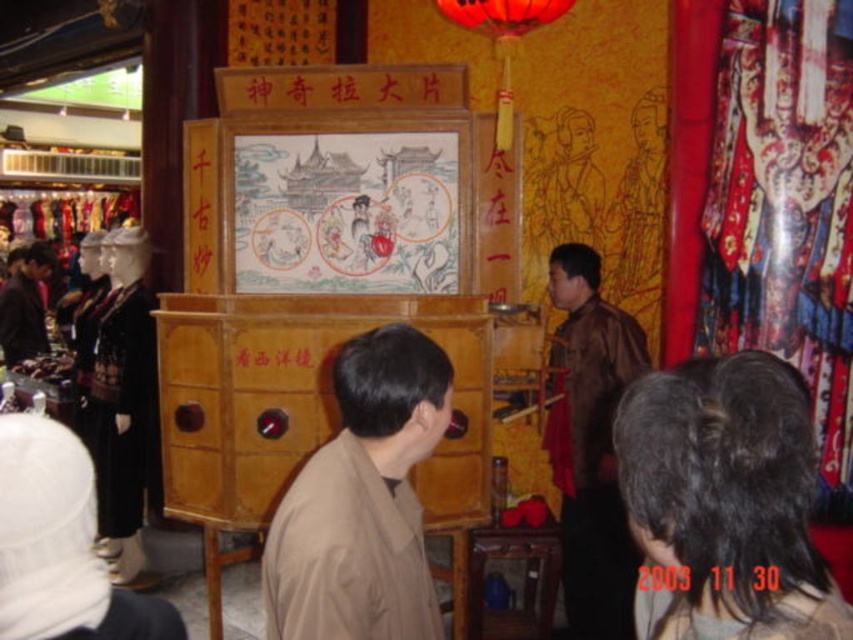
Question: Estimate the real-world distances between objects in this image. Which object is closer to the black paper at center?

Choices:
 (A) brown matte jacket at center
 (B) brown leather jacket at center
 (C) brown leather jacket at left
 (D) black hair at upper center

Answer: (D)

Question: Does brown matte jacket at center lie behind brown leather jacket at left?

Choices:
 (A) no
 (B) yes

Answer: (A)

Question: Which object appears closest to the camera in this image?

Choices:
 (A) brown leather jacket at center
 (B) black paper at center
 (C) brown matte jacket at center

Answer: (B)

Question: Is black hair at upper center positioned before brown leather jacket at left?

Choices:
 (A) no
 (B) yes

Answer: (B)

Question: Does brown leather jacket at left lie behind black paper at center?

Choices:
 (A) no
 (B) yes

Answer: (B)

Question: Considering the real-world distances, which object is closest to the black paper at center?

Choices:
 (A) black hair at upper center
 (B) brown leather jacket at center
 (C) brown leather jacket at left

Answer: (A)